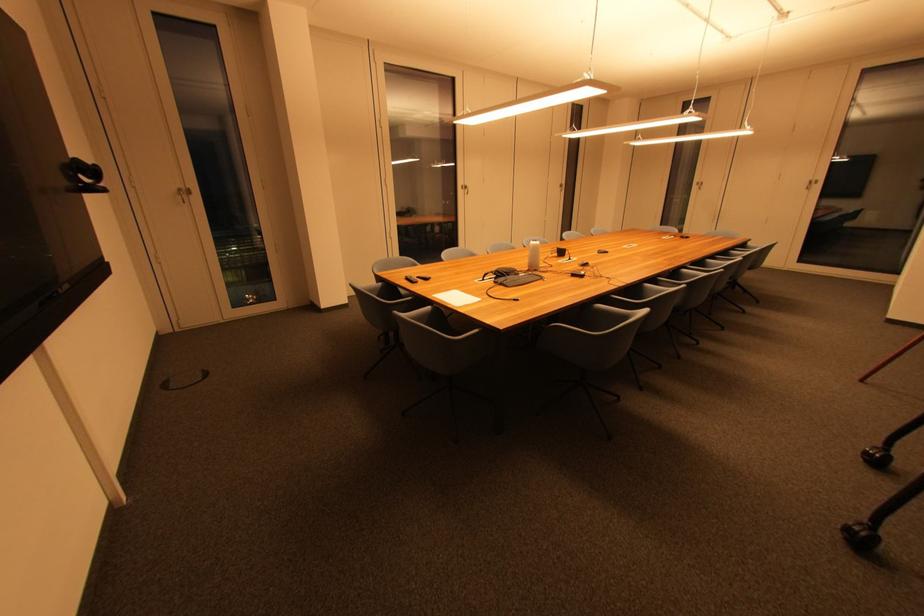
This screenshot has width=924, height=616. Describe the element at coordinates (513, 277) in the screenshot. I see `the conference phone handset` at that location.